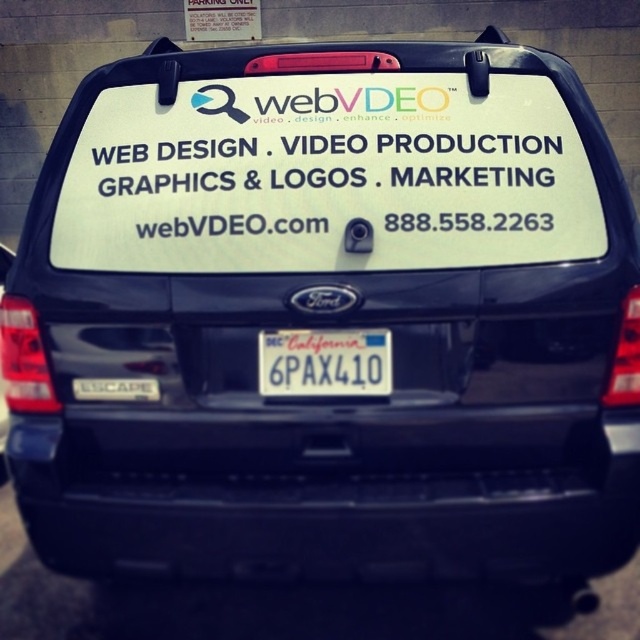
Which is in front, point (128, 240) or point (305, 339)?

Point (305, 339) is in front.

Is white paper sign at center to the left of white plastic license plate at center from the viewer's perspective?

Correct, you'll find white paper sign at center to the left of white plastic license plate at center.

Is point (150, 200) behind point (388, 372)?

Yes, point (150, 200) is behind point (388, 372).

Where is `white paper sign at center`? white paper sign at center is located at coordinates (326, 170).

Who is shorter, white plastic license plate at center or white plastic sign at upper center?

With less height is white plastic license plate at center.

You are a GUI agent. You are given a task and a screenshot of the screen. Output one action in this format:
    pyautogui.click(x=<x>, y=<y>)
    Task: Click on the white plastic license plate at center
    This screenshot has height=640, width=640.
    Given the screenshot: What is the action you would take?
    (324, 362)

Is white paper sign at center shorter than white plastic sign at upper center?

Yes, white paper sign at center is shorter than white plastic sign at upper center.

Looking at this image, can you confirm if white paper sign at center is positioned above white plastic sign at upper center?

Incorrect, white paper sign at center is not positioned above white plastic sign at upper center.

Between point (262, 122) and point (241, 29), which one is positioned in front?

Point (262, 122) is in front.

Locate an element on the screen. The image size is (640, 640). white paper sign at center is located at coordinates (326, 170).